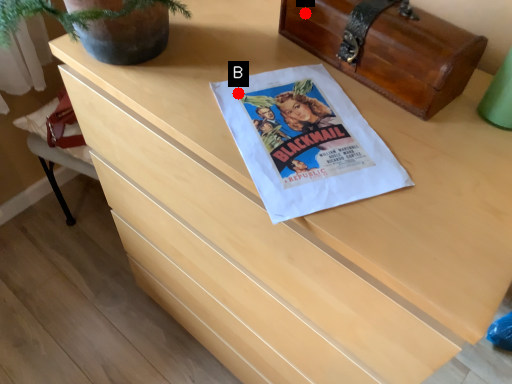
Question: Two points are circled on the image, labeled by A and B beside each circle. Which point appears farthest from the camera in this image?

Choices:
 (A) A is further
 (B) B is further

Answer: (A)